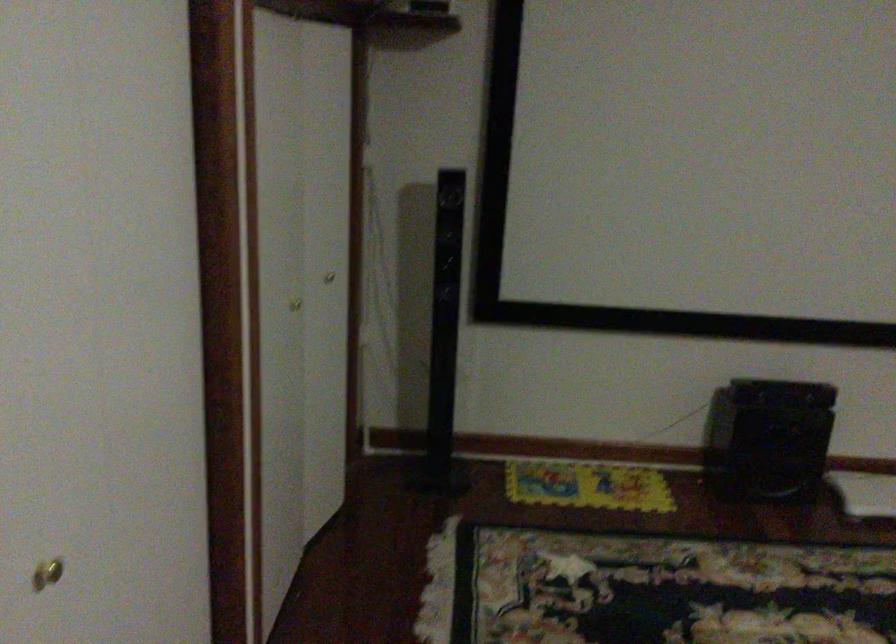
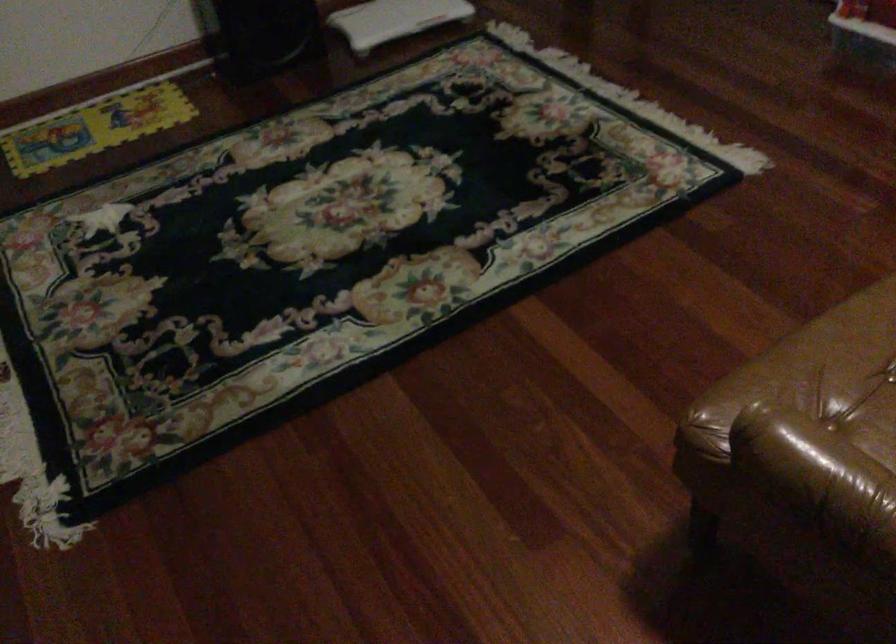
The images are taken continuously from a first-person perspective. In which direction is your viewpoint rotating?

The camera's rotation is toward right-down.